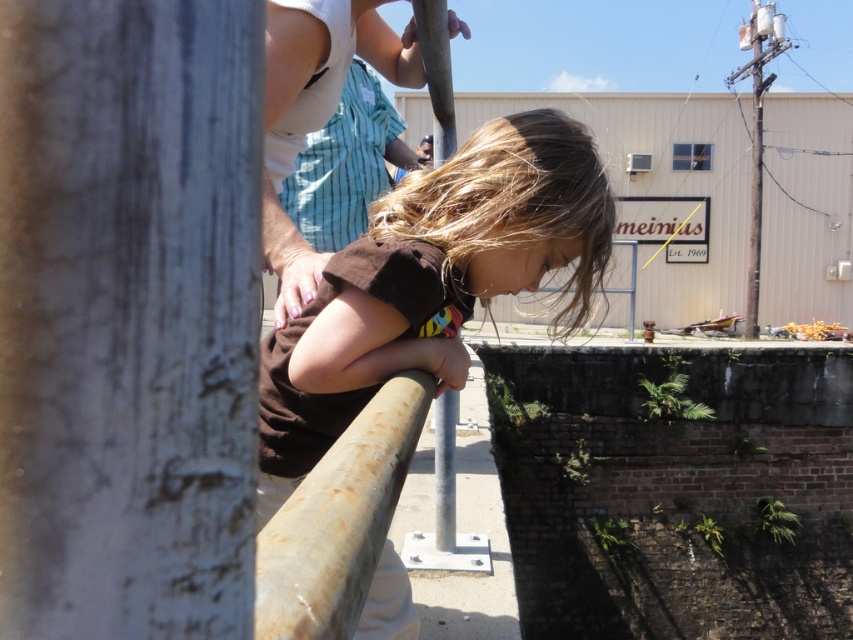
You are a photographer trying to capture a candid shot of the girl leaning on the metal railing. Since both the brown matte shirt at center and the brown matte hair at center are visible, which one is closer to the camera?

The brown matte shirt at center is closer to the camera because it is in front of the brown matte hair at center.

You are a photographer trying to capture the girl in the scene. You want to ensure that both the brown matte shirt at center and the brown matte hair at center are clearly visible in your photo. Based on their positions, which one will appear larger in the photo?

The brown matte shirt at center will appear larger in the photo because it is taller than the brown matte hair at center.